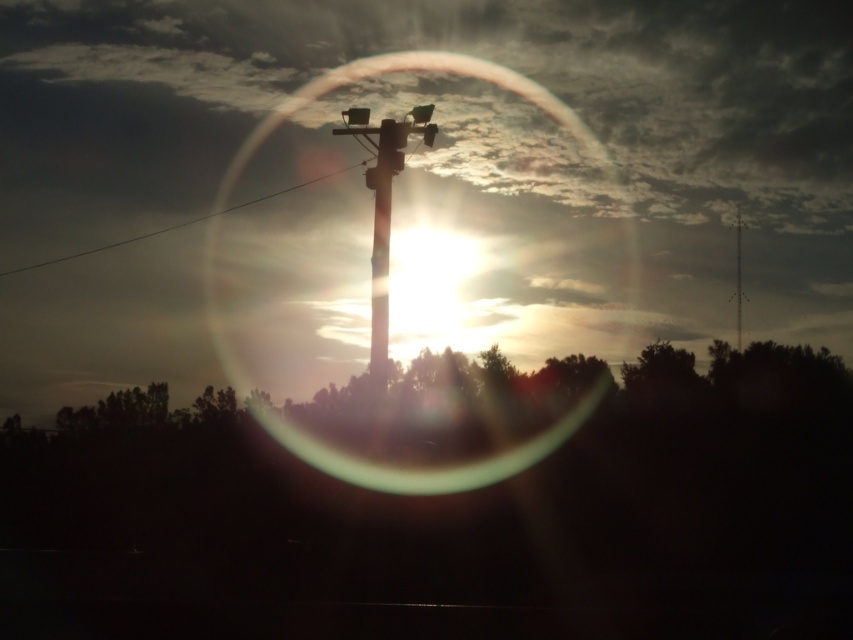
You are a photographer adjusting your camera to capture the sunset scene. You notice the black wire at upper left and the smooth wood telegraph pole at upper center in your frame. Which object appears higher in the image?

The black wire at upper left appears higher in the image because it is taller than the smooth wood telegraph pole at upper center.

You are a delivery drone with a wingspan of 2 meters. You need to fly through the space between the transparent glass bubble at center and the smooth wood telegraph pole at center. Can you safely pass through without touching either object?

The distance between the transparent glass bubble at center and the smooth wood telegraph pole at center is 3.87 meters. Since your wingspan is 2 meters, you have enough clearance to safely pass through the space between them.